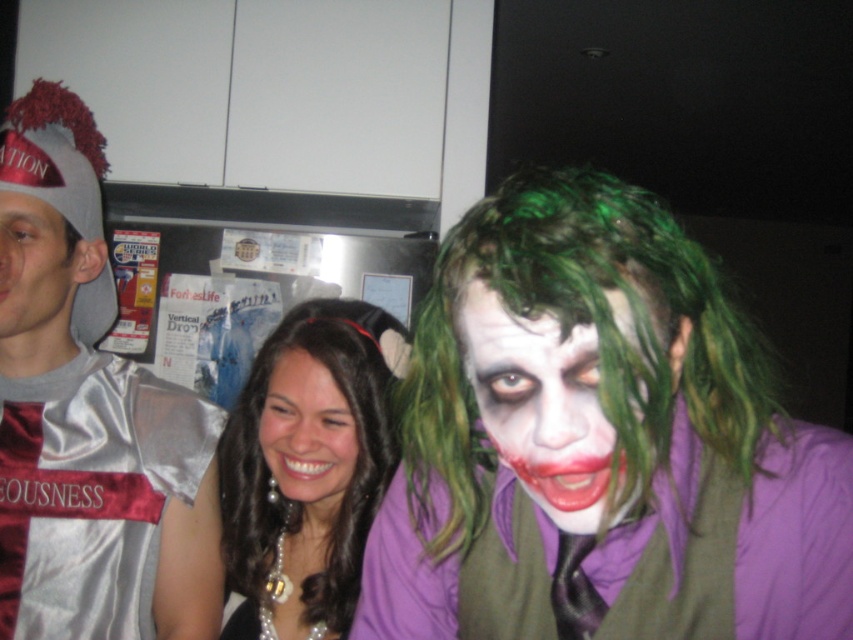
Between point (428, 449) and point (512, 496), which one is positioned in front?

Positioned in front is point (428, 449).

This screenshot has height=640, width=853. What do you see at coordinates (572, 337) in the screenshot? I see `green synthetic wig at right` at bounding box center [572, 337].

This screenshot has width=853, height=640. I want to click on green synthetic wig at right, so click(x=572, y=337).

Is the position of silver satin jersey at left more distant than that of green synthetic wig at right?

Yes.

What do you see at coordinates (86, 416) in the screenshot? This screenshot has width=853, height=640. I see `silver satin jersey at left` at bounding box center [86, 416].

I want to click on silver satin jersey at left, so click(x=86, y=416).

Between green matte wig at upper right and black pearl necklace at center, which one has less height?

Standing shorter between the two is green matte wig at upper right.

Does green matte wig at upper right have a greater height compared to black pearl necklace at center?

In fact, green matte wig at upper right may be shorter than black pearl necklace at center.

Is point (366, 586) positioned after point (346, 324)?

That is False.

Locate an element on the screen. The width and height of the screenshot is (853, 640). green matte wig at upper right is located at coordinates (796, 538).